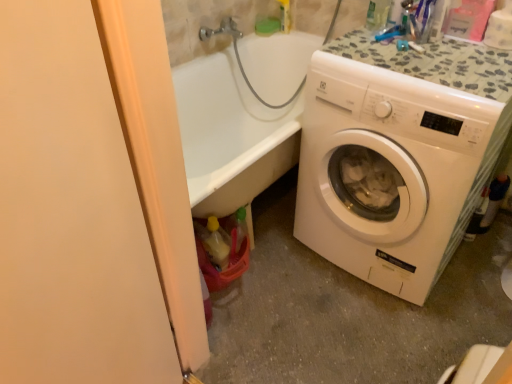
Question: Considering the relative sizes of matte peach screen door at left and white plastic washing machine at right in the image provided, is matte peach screen door at left wider than white plastic washing machine at right?

Choices:
 (A) yes
 (B) no

Answer: (B)

Question: Are matte peach screen door at left and white plastic washing machine at right far apart?

Choices:
 (A) yes
 (B) no

Answer: (B)

Question: From the image's perspective, does matte peach screen door at left appear lower than white plastic washing machine at right?

Choices:
 (A) no
 (B) yes

Answer: (B)

Question: Is matte peach screen door at left at the left side of white plastic washing machine at right?

Choices:
 (A) no
 (B) yes

Answer: (B)

Question: Is matte peach screen door at left positioned behind white plastic washing machine at right?

Choices:
 (A) yes
 (B) no

Answer: (B)

Question: Is matte peach screen door at left shorter than white plastic washing machine at right?

Choices:
 (A) no
 (B) yes

Answer: (A)

Question: From the image's perspective, is white plastic washing machine at right beneath matte peach screen door at left?

Choices:
 (A) no
 (B) yes

Answer: (A)

Question: Is white plastic washing machine at right behind matte peach screen door at left?

Choices:
 (A) yes
 (B) no

Answer: (A)

Question: From the image's perspective, is white plastic washing machine at right above matte peach screen door at left?

Choices:
 (A) yes
 (B) no

Answer: (A)

Question: From a real-world perspective, is white plastic washing machine at right physically above matte peach screen door at left?

Choices:
 (A) no
 (B) yes

Answer: (A)

Question: Is the depth of white plastic washing machine at right less than that of matte peach screen door at left?

Choices:
 (A) yes
 (B) no

Answer: (B)

Question: Does white plastic washing machine at right have a greater width compared to matte peach screen door at left?

Choices:
 (A) no
 (B) yes

Answer: (B)

Question: In terms of size, does white plastic washing machine at right appear bigger or smaller than matte peach screen door at left?

Choices:
 (A) big
 (B) small

Answer: (A)